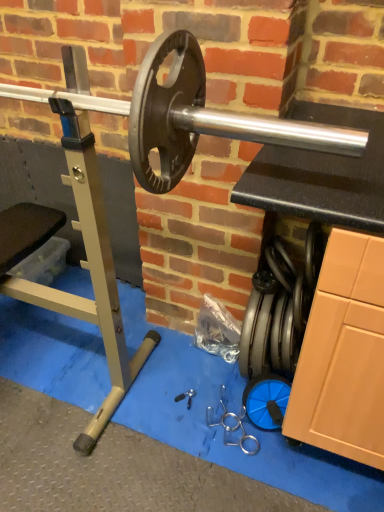
Question: Is silver metallic barbell at center bigger or smaller than metallic silver tool at center?

Choices:
 (A) big
 (B) small

Answer: (A)

Question: Choose the correct answer: Is silver metallic barbell at center inside metallic silver tool at center or outside it?

Choices:
 (A) outside
 (B) inside

Answer: (A)

Question: From a real-world perspective, is silver metallic barbell at center physically located above or below metallic silver tool at center?

Choices:
 (A) below
 (B) above

Answer: (B)

Question: From their relative heights in the image, would you say metallic silver tool at center is taller or shorter than silver metallic barbell at center?

Choices:
 (A) short
 (B) tall

Answer: (A)

Question: Is metallic silver tool at center inside the boundaries of silver metallic barbell at center, or outside?

Choices:
 (A) outside
 (B) inside

Answer: (A)

Question: Does point (188, 397) appear closer or farther from the camera than point (178, 51)?

Choices:
 (A) farther
 (B) closer

Answer: (A)

Question: In the image, is metallic silver tool at center on the left side or the right side of silver metallic barbell at center?

Choices:
 (A) left
 (B) right

Answer: (B)